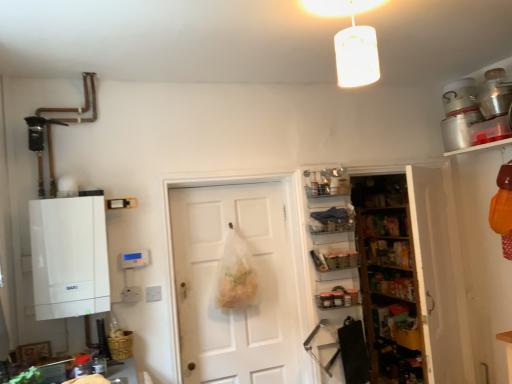
Question: Is white matte boiler at left in front of or behind clear plastic shelves at center, the 4th shelf from the bottom, in the image?

Choices:
 (A) behind
 (B) front

Answer: (B)

Question: Is white matte boiler at left taller or shorter than clear plastic shelves at center, the 4th shelf from the bottom?

Choices:
 (A) tall
 (B) short

Answer: (A)

Question: Which is farther from the white matte cylinder at upper center?

Choices:
 (A) metallic silver spice rack at center-right, arranged as the third shelf when ordered from the bottom
 (B) wooden shelves at right, marked as the third shelf in a top-to-bottom arrangement
 (C) metallic silver spice jars at center-right, the 1th shelf in the bottom-to-top sequence
 (D) bamboo basket at lower left
 (E) white matte door at center

Answer: (B)

Question: Estimate the real-world distances between objects in this image. Which object is closer to the metallic silver spice rack at center-right, arranged as the third shelf when ordered from the bottom?

Choices:
 (A) white matte cylinder at upper center
 (B) bamboo basket at lower left
 (C) silver metallic canister at upper right, marked as the first appliance in a back-to-front arrangement
 (D) white matte boiler at left
 (E) white matte door at center

Answer: (E)